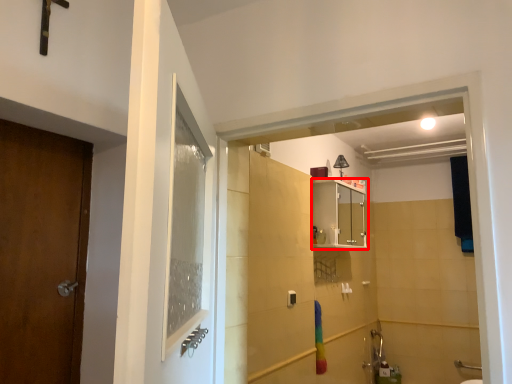
Question: From the image's perspective, where is cabinetry (annotated by the red box) located relative to light fixture?

Choices:
 (A) below
 (B) above

Answer: (A)